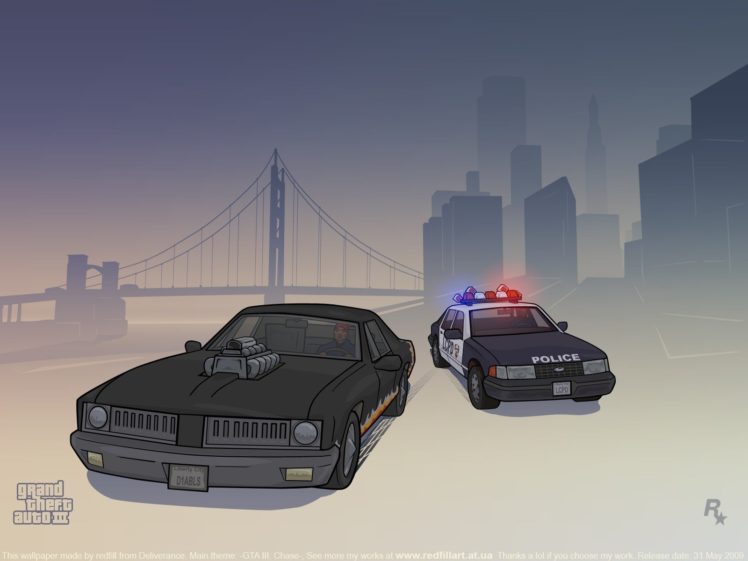
Find the location of a particular element. The image size is (748, 561). floor is located at coordinates (579, 494).